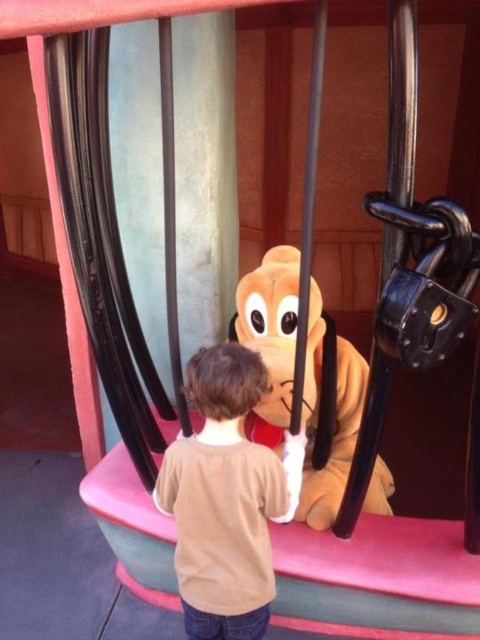
Which is more to the right, brown cotton shirt at center or fuzzy yellow dog at center?

From the viewer's perspective, fuzzy yellow dog at center appears more on the right side.

How distant is brown cotton shirt at center from fuzzy yellow dog at center?

brown cotton shirt at center and fuzzy yellow dog at center are 14.76 inches apart from each other.

Is point (219, 577) less distant than point (310, 371)?

That is True.

The height and width of the screenshot is (640, 480). Find the location of `brown cotton shirt at center`. brown cotton shirt at center is located at coordinates (226, 499).